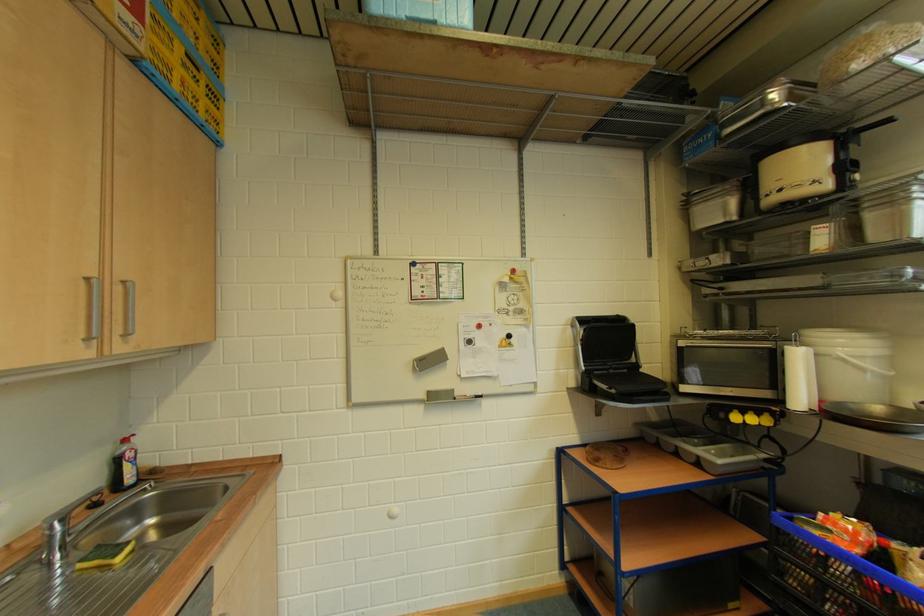
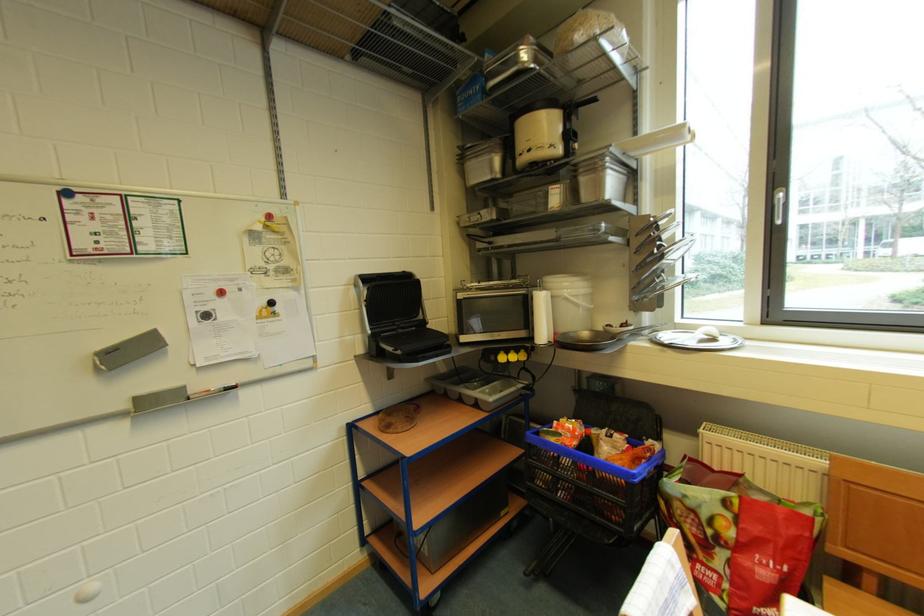
In the second image, find the point that corresponds to pixel 728 419 in the first image.

(500, 361)